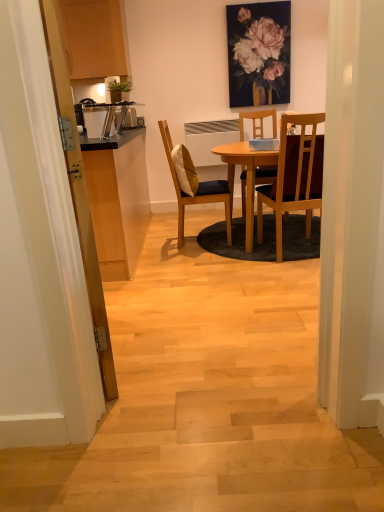
Find the location of `vacant space behind transparent wooden door at left`. vacant space behind transparent wooden door at left is located at coordinates (135, 309).